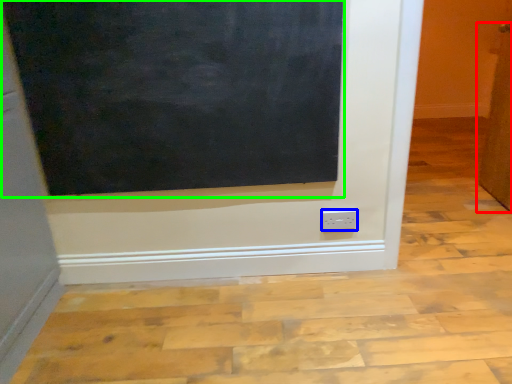
Question: Which is nearer to the door (highlighted by a red box)? power plugs and sockets (highlighted by a blue box) or bulletin board (highlighted by a green box).

Choices:
 (A) power plugs and sockets
 (B) bulletin board

Answer: (A)